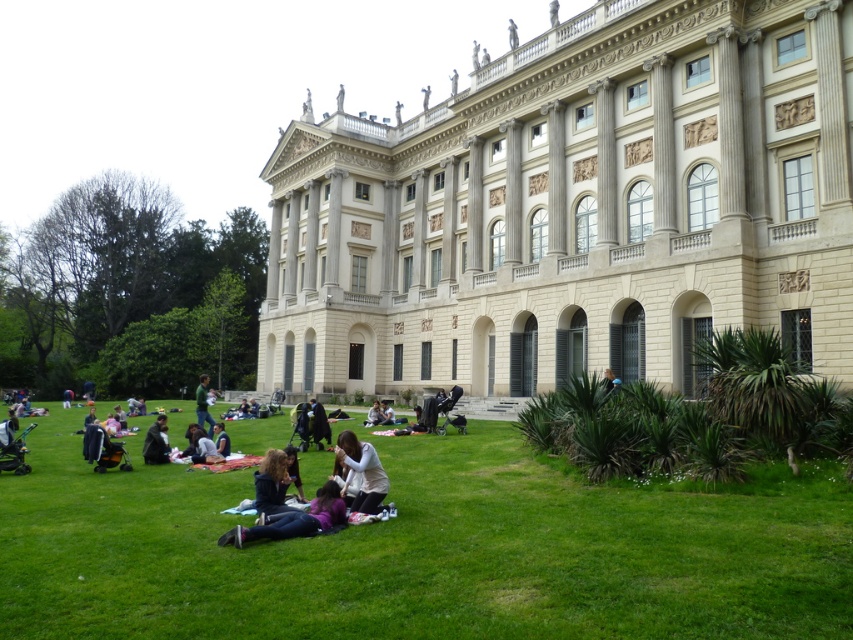
Question: Is light gray fabric at center behind light brown leather jacket at lower right?

Choices:
 (A) no
 (B) yes

Answer: (A)

Question: Does light beige sweater at center lie in front of light brown leather jacket at lower right?

Choices:
 (A) yes
 (B) no

Answer: (A)

Question: Which point is farther to the camera?

Choices:
 (A) dark matte coat at center
 (B) dark blue jeans at lower center
 (C) light gray fabric at center

Answer: (A)

Question: Which is nearer to the green grass at lower center?

Choices:
 (A) light gray fabric at center
 (B) light brown fabric at center
 (C) light beige sweater at center

Answer: (C)

Question: Can you confirm if green grass at lower center is positioned to the right of light brown fabric at center?

Choices:
 (A) no
 (B) yes

Answer: (B)

Question: Which object is the closest to the beige stone palace at center?

Choices:
 (A) green grass at lower center
 (B) dark blue jeans at lower center
 (C) light brown leather jacket at lower right
 (D) dark gray coat at lower left

Answer: (C)